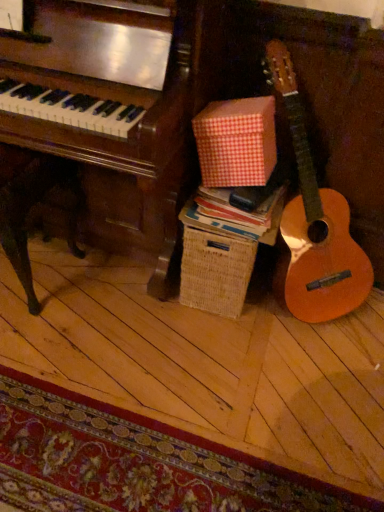
Question: Is red checkered paper at center shorter than red checkered cardboard box at center?

Choices:
 (A) yes
 (B) no

Answer: (A)

Question: Does red checkered paper at center have a larger size compared to red checkered cardboard box at center?

Choices:
 (A) yes
 (B) no

Answer: (B)

Question: Is red checkered paper at center positioned beyond the bounds of red checkered cardboard box at center?

Choices:
 (A) no
 (B) yes

Answer: (B)

Question: Are red checkered paper at center and red checkered cardboard box at center located far from each other?

Choices:
 (A) yes
 (B) no

Answer: (B)

Question: Is red checkered paper at center taller than red checkered cardboard box at center?

Choices:
 (A) yes
 (B) no

Answer: (B)

Question: Is carpeted mat at lower left inside or outside of red checkered paper at center?

Choices:
 (A) outside
 (B) inside

Answer: (A)

Question: Is carpeted mat at lower left bigger or smaller than red checkered paper at center?

Choices:
 (A) big
 (B) small

Answer: (A)

Question: From the image's perspective, is carpeted mat at lower left positioned above or below red checkered paper at center?

Choices:
 (A) above
 (B) below

Answer: (B)

Question: Considering the relative positions of carpeted mat at lower left and red checkered paper at center in the image provided, is carpeted mat at lower left to the left or to the right of red checkered paper at center?

Choices:
 (A) left
 (B) right

Answer: (A)

Question: Is red checkered paper at center situated inside carpeted mat at lower left or outside?

Choices:
 (A) inside
 (B) outside

Answer: (B)

Question: From the image's perspective, is red checkered paper at center positioned above or below carpeted mat at lower left?

Choices:
 (A) above
 (B) below

Answer: (A)

Question: Considering the positions of red checkered paper at center and carpeted mat at lower left in the image, is red checkered paper at center bigger or smaller than carpeted mat at lower left?

Choices:
 (A) small
 (B) big

Answer: (A)

Question: In terms of width, does red checkered paper at center look wider or thinner when compared to carpeted mat at lower left?

Choices:
 (A) wide
 (B) thin

Answer: (B)

Question: In the image, is red checkered cardboard box at center positioned in front of or behind red checkered paper at center?

Choices:
 (A) behind
 (B) front

Answer: (B)

Question: Looking at their shapes, would you say red checkered cardboard box at center is wider or thinner than red checkered paper at center?

Choices:
 (A) thin
 (B) wide

Answer: (A)